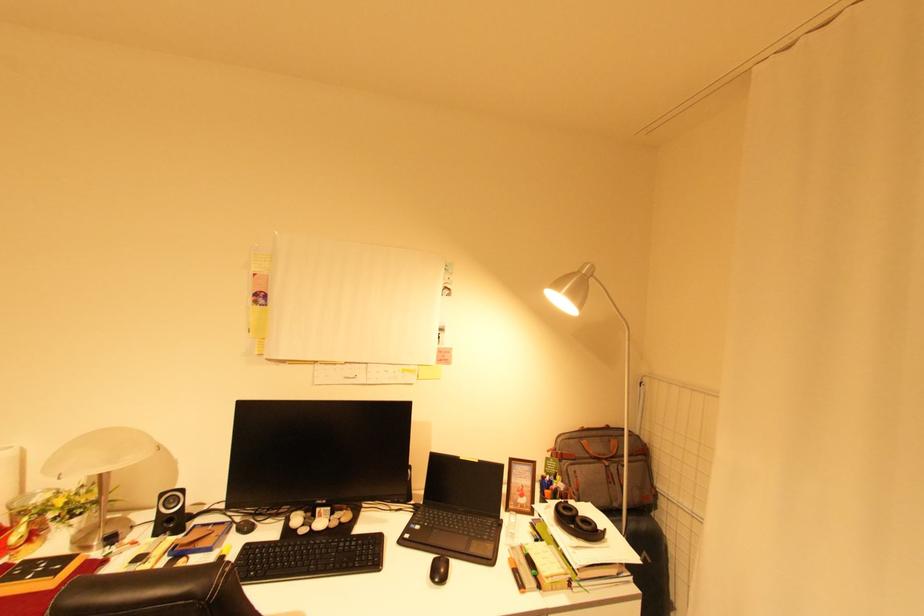
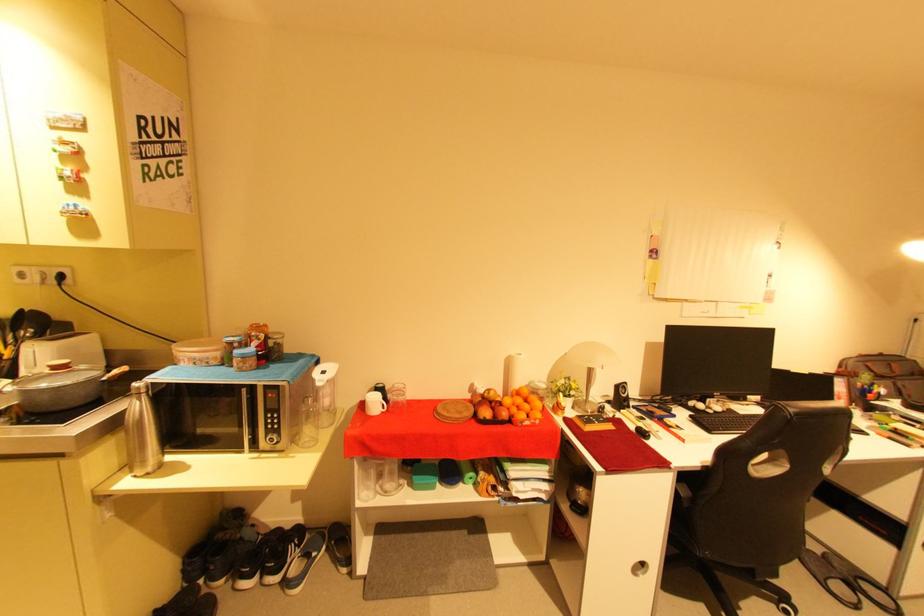
Which direction would the cameraman need to move to produce the second image?

The movement direction of the cameraman is left, backward.